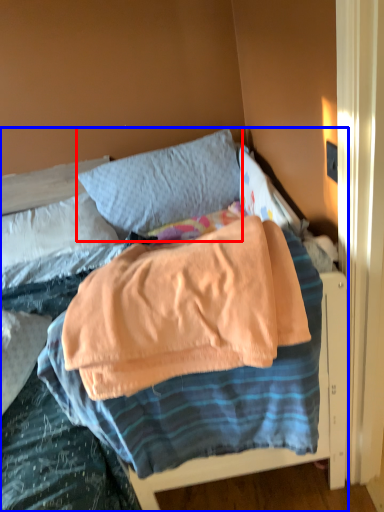
Question: Among these objects, which one is farthest to the camera, pillow (highlighted by a red box) or bed (highlighted by a blue box)?

Choices:
 (A) pillow
 (B) bed

Answer: (A)